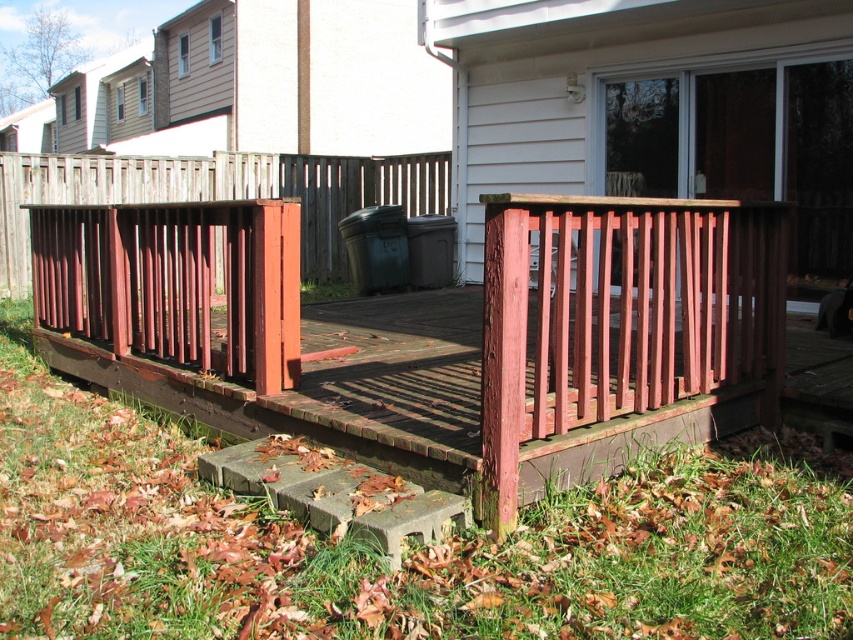
Does wooden porch at center have a greater height compared to wooden slats at lower right?

Indeed, wooden porch at center has a greater height compared to wooden slats at lower right.

Is point (396, 390) closer to camera compared to point (526, 224)?

No, it is not.

The image size is (853, 640). Find the location of `wooden porch at center`. wooden porch at center is located at coordinates (436, 332).

Does point (537, 436) lie behind point (265, 448)?

No, it is in front of (265, 448).

Is wooden porch at center below gray concrete step at lower left?

Actually, wooden porch at center is above gray concrete step at lower left.

The image size is (853, 640). Identify the location of wooden porch at center. (436, 332).

Who is shorter, rustic wood fence at center or gray concrete step at lower left?

gray concrete step at lower left

Between rustic wood fence at center and gray concrete step at lower left, which one appears on the right side from the viewer's perspective?

gray concrete step at lower left is more to the right.

Identify the location of rustic wood fence at center. The height and width of the screenshot is (640, 853). (218, 193).

Where is `rustic wood fence at center`? The width and height of the screenshot is (853, 640). rustic wood fence at center is located at coordinates (218, 193).